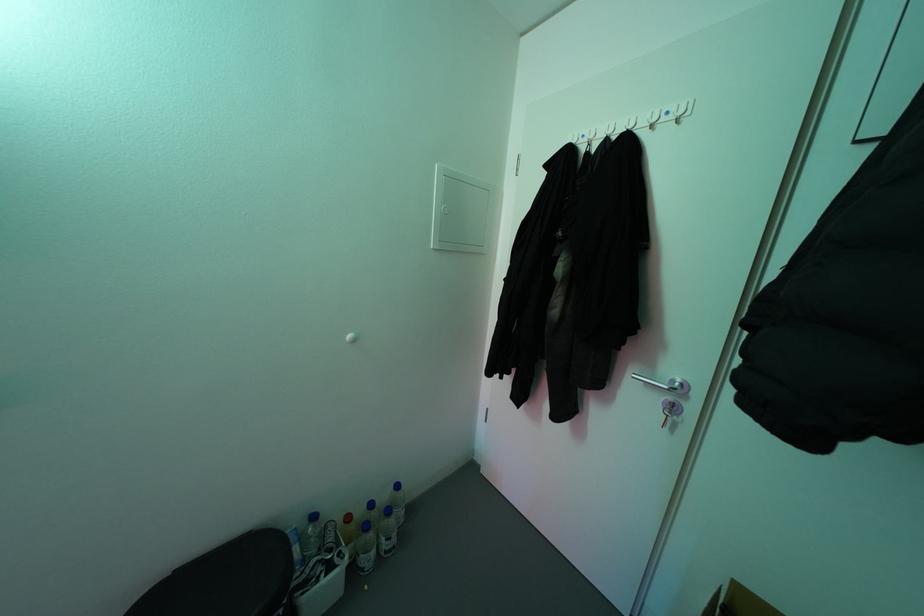
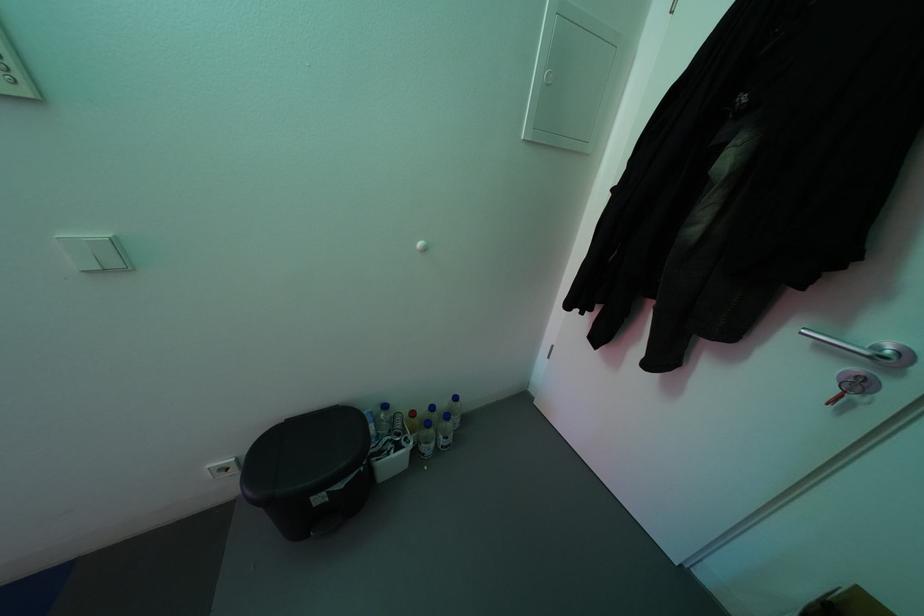
Question: The first image is from the beginning of the video and the second image is from the end. How did the camera likely rotate when shooting the video?

Choices:
 (A) Left
 (B) Right
 (C) Up
 (D) Down

Answer: (D)